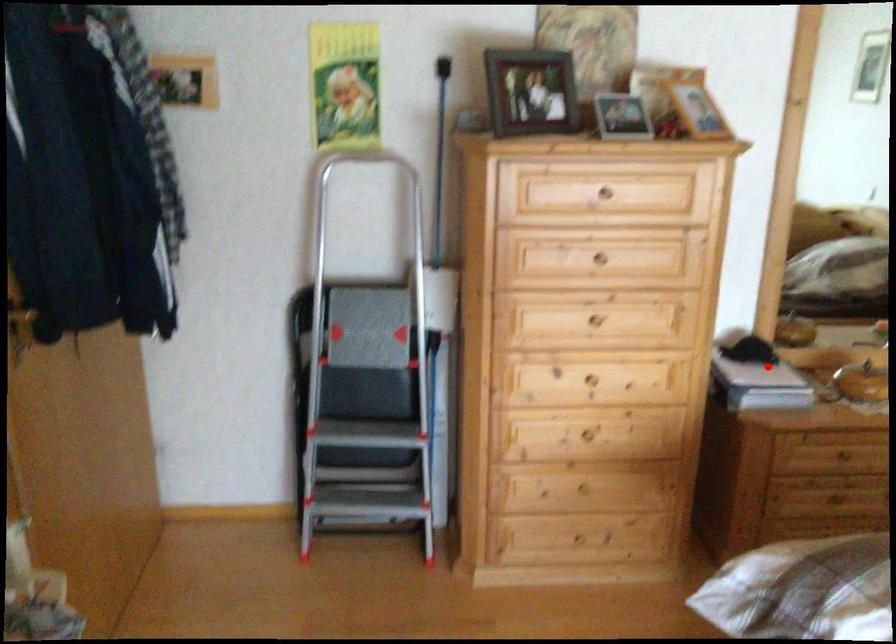
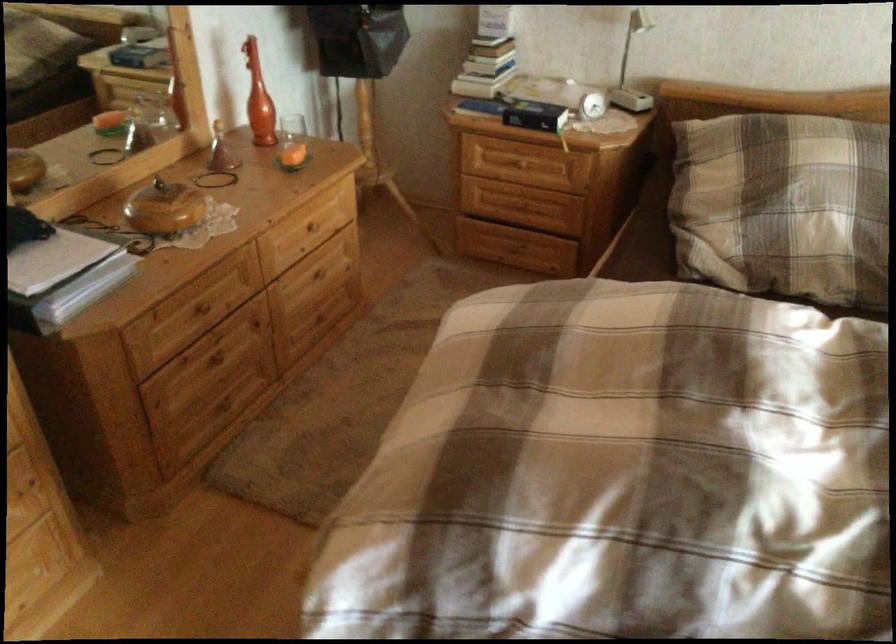
Find the pixel in the second image that matches the highlighted location in the first image.

(55, 260)